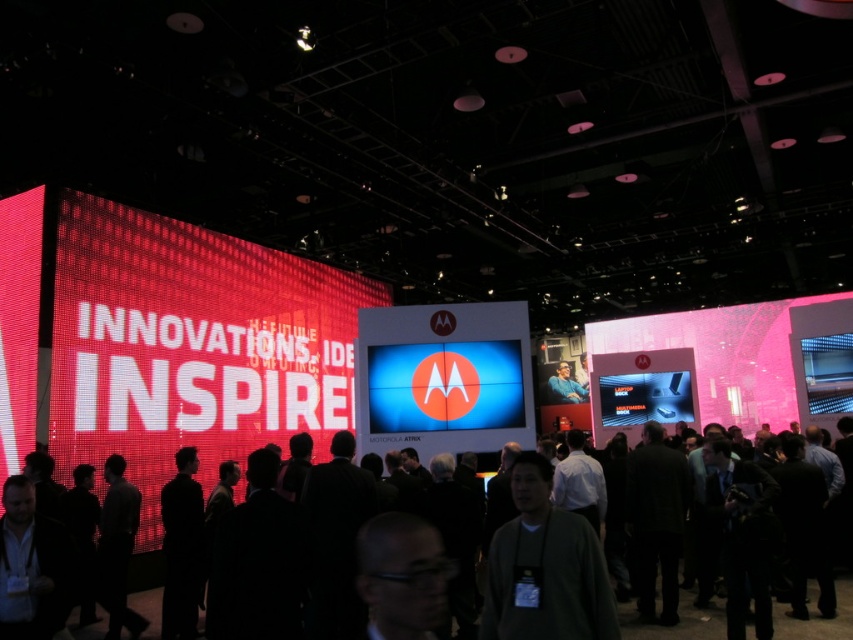
Question: Can you confirm if shiny blue screen at center is positioned to the left of metallic silver phone at center?

Choices:
 (A) no
 (B) yes

Answer: (B)

Question: Can you confirm if black fabric crowd at center is positioned to the right of blue fabric shirt at center?

Choices:
 (A) yes
 (B) no

Answer: (B)

Question: Which object is the farthest from the metallic blue screen at upper right?

Choices:
 (A) dark gray sweater at center
 (B) black fabric crowd at center

Answer: (A)

Question: Is dark gray sweater at center wider than metallic blue screen at upper right?

Choices:
 (A) no
 (B) yes

Answer: (A)

Question: Among these objects, which one is farthest from the camera?

Choices:
 (A) blue fabric shirt at center
 (B) dark gray sweater at center
 (C) metallic blue screen at upper right
 (D) black fabric crowd at center

Answer: (A)

Question: Estimate the real-world distances between objects in this image. Which object is closer to the metallic silver phone at center?

Choices:
 (A) blue fabric shirt at center
 (B) metallic blue screen at upper right

Answer: (B)